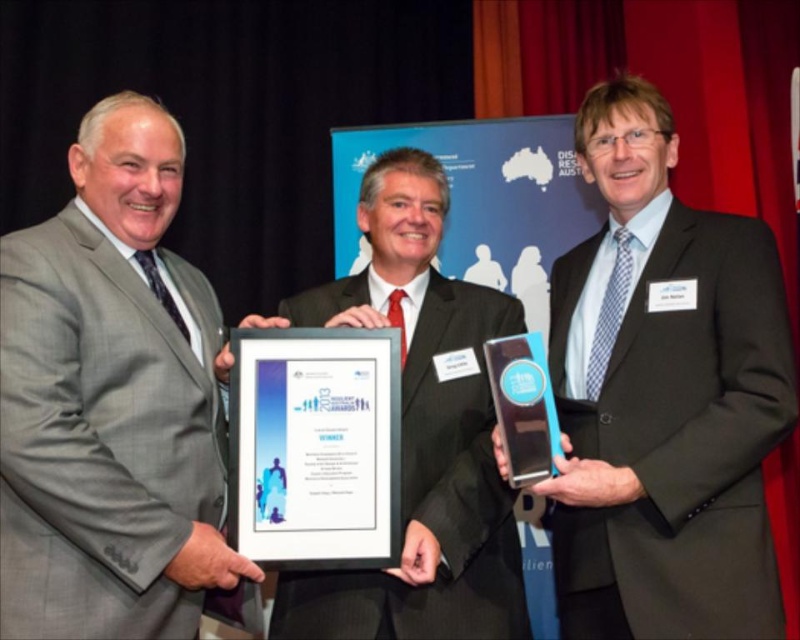
You are a photographer at the award ceremony. You need to capture a group photo of the matte black suit at center and the matte gray suit at center. The camera you are using has a minimum focus distance of 34 inches. Will you be able to focus on both subjects clearly without moving the camera closer?

The distance between the matte black suit at center and the matte gray suit at center is 33.99 inches, which is just below the camera minimum focus distance of 34 inches. Therefore, the camera may struggle to focus on both subjects clearly without moving closer.

Looking at this image, you are standing in the award ceremony scene and want to move from point A to point B. Point A is at coordinate point [672,285] and point B is at coordinate point [24,241]. Which point is closer to you when you are facing the scene?

Point B at coordinate point [24,241] is closer to you because it is less further to the viewer than point A at coordinate point [672,285].